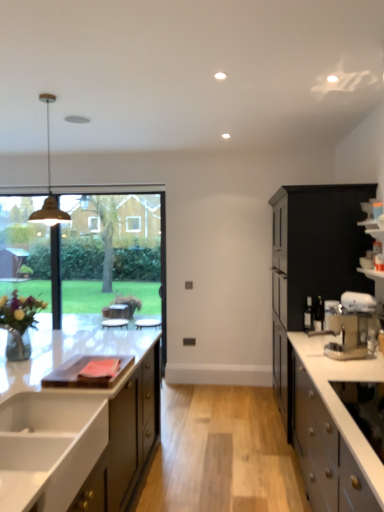
What do you see at coordinates (86, 254) in the screenshot? The width and height of the screenshot is (384, 512). I see `transparent glass window at center, acting as the second window screen starting from the left` at bounding box center [86, 254].

Measure the distance between point (146, 394) and camera.

Point (146, 394) and camera are 3.05 meters apart from each other.

Measure the distance between matte black cabinet at right, the 1th cabinetry in the right-to-left sequence, and camera.

They are 10.59 feet apart.

Describe the element at coordinates (320, 242) in the screenshot. The image size is (384, 512). I see `matte black cabinet at right, which is the third cabinetry from left to right` at that location.

Measure the distance between metallic silver coffee machine at right and camera.

metallic silver coffee machine at right is 2.58 meters from camera.

Locate an element on the screen. The width and height of the screenshot is (384, 512). transparent glass window at center, acting as the second window screen starting from the left is located at coordinates (86, 254).

From the image's perspective, is matte black cabinet at right, the 1th cabinetry in the right-to-left sequence, positioned above or below white glossy sink at lower left?

matte black cabinet at right, the 1th cabinetry in the right-to-left sequence, is situated higher than white glossy sink at lower left in the image.

Is the surface of matte black cabinet at right, the 1th cabinetry in the right-to-left sequence, in direct contact with white glossy sink at lower left?

No, matte black cabinet at right, the 1th cabinetry in the right-to-left sequence, is not in contact with white glossy sink at lower left.

What's the angular difference between matte black cabinet at right, which is the third cabinetry from left to right, and white glossy sink at lower left's facing directions?

The facing directions of matte black cabinet at right, which is the third cabinetry from left to right, and white glossy sink at lower left are 180 degrees apart.

In terms of height, does white matte cabinet at right, the 2th cabinetry in the left-to-right sequence, look taller or shorter compared to matte brass pendant light at upper left?

In the image, white matte cabinet at right, the 2th cabinetry in the left-to-right sequence, appears to be taller than matte brass pendant light at upper left.

Is white matte cabinet at right, which is counted as the second cabinetry, starting from the right, bigger or smaller than matte brass pendant light at upper left?

In the image, white matte cabinet at right, which is counted as the second cabinetry, starting from the right, appears to be larger than matte brass pendant light at upper left.

Is the surface of white matte cabinet at right, the 2th cabinetry in the left-to-right sequence, in direct contact with matte brass pendant light at upper left?

No, white matte cabinet at right, the 2th cabinetry in the left-to-right sequence, is not touching matte brass pendant light at upper left.

From a real-world perspective, is metallic silver coffee machine at right beneath matte brass pendant light at upper left?

Indeed, from a real-world perspective, metallic silver coffee machine at right is positioned beneath matte brass pendant light at upper left.

Locate an element on the screen. The height and width of the screenshot is (512, 384). coffee machine on the right side of matte brass pendant light at upper left is located at coordinates (351, 326).

Is metallic silver coffee machine at right inside or outside of matte brass pendant light at upper left?

metallic silver coffee machine at right exists outside the volume of matte brass pendant light at upper left.

Identify the location of the 2nd cabinetry located beneath the translucent glass window screen at left, the 2th window screen when ordered from right to left (from a real-world perspective). The image size is (384, 512). (340, 400).

Would you say translucent glass window screen at left, which ranks as the first window screen in left-to-right order, is inside or outside white matte cabinet at right, which is counted as the second cabinetry, starting from the right?

translucent glass window screen at left, which ranks as the first window screen in left-to-right order, exists outside the volume of white matte cabinet at right, which is counted as the second cabinetry, starting from the right.

From a real-world perspective, who is located lower, translucent glass window screen at left, which ranks as the first window screen in left-to-right order, or white matte cabinet at right, which is counted as the second cabinetry, starting from the right?

white matte cabinet at right, which is counted as the second cabinetry, starting from the right.

From the image's perspective, is translucent glass window screen at left, the 2th window screen when ordered from right to left, located above or below white matte cabinet at right, which is counted as the second cabinetry, starting from the right?

From the image's perspective, translucent glass window screen at left, the 2th window screen when ordered from right to left, appears above white matte cabinet at right, which is counted as the second cabinetry, starting from the right.

Which of these two, matte brass pendant light at upper left or matte black cabinet at right, which is the third cabinetry from left to right, is wider?

matte black cabinet at right, which is the third cabinetry from left to right.

From a real-world perspective, between matte brass pendant light at upper left and matte black cabinet at right, the 1th cabinetry in the right-to-left sequence, who is vertically higher?

In real-world perspective, matte brass pendant light at upper left is above.

Which object is further away from the camera taking this photo, matte brass pendant light at upper left or matte black cabinet at right, which is the third cabinetry from left to right?

Positioned behind is matte black cabinet at right, which is the third cabinetry from left to right.

Based on the photo, does matte brass pendant light at upper left have a lesser height compared to matte black cabinet at right, which is the third cabinetry from left to right?

→ Correct, matte brass pendant light at upper left is not as tall as matte black cabinet at right, which is the third cabinetry from left to right.

Which is behind, metallic silver coffee machine at right or matte white cabinetry at left, which is the 1th cabinetry in left-to-right order?

metallic silver coffee machine at right.

Which is more to the right, metallic silver coffee machine at right or matte white cabinetry at left, which is the 1th cabinetry in left-to-right order?

metallic silver coffee machine at right.

Can we say metallic silver coffee machine at right lies outside matte white cabinetry at left, which is the 1th cabinetry in left-to-right order?

Indeed, metallic silver coffee machine at right is completely outside matte white cabinetry at left, which is the 1th cabinetry in left-to-right order.

In the image, is translucent glass window screen at left, the 2th window screen when ordered from right to left, positioned in front of or behind matte black cabinet at right, the 1th cabinetry in the right-to-left sequence?

translucent glass window screen at left, the 2th window screen when ordered from right to left, is positioned farther from the viewer than matte black cabinet at right, the 1th cabinetry in the right-to-left sequence.

Does translucent glass window screen at left, the 2th window screen when ordered from right to left, turn towards matte black cabinet at right, the 1th cabinetry in the right-to-left sequence?

No, translucent glass window screen at left, the 2th window screen when ordered from right to left, is not oriented towards matte black cabinet at right, the 1th cabinetry in the right-to-left sequence.

From the translucent glass window screen at left, the 2th window screen when ordered from right to left, count 3rd cabinetry to the right and point to it. Please provide its 2D coordinates.

[(320, 242)]

Is point (45, 294) closer or farther from the camera than point (357, 238)?

Clearly, point (45, 294) is more distant from the camera than point (357, 238).

Find the location of a particular element. Image resolution: width=384 pixels, height=512 pixels. sink directly beneath the matte black cabinet at right, the 1th cabinetry in the right-to-left sequence (from a real-world perspective) is located at coordinates (48, 448).

The height and width of the screenshot is (512, 384). There is a matte brass pendant light at upper left. Find the location of `the 2nd cabinetry below it (from the image's perspective)`. the 2nd cabinetry below it (from the image's perspective) is located at coordinates (340, 400).

Looking at the image, which one is located further to matte brass pendant light at upper left, white glossy sink at lower left or matte white cabinetry at left, positioned as the third cabinetry in right-to-left order?

Among the two, white glossy sink at lower left is located further to matte brass pendant light at upper left.

Looking at the image, which one is located further to matte white cabinetry at left, positioned as the third cabinetry in right-to-left order, matte black cabinet at right, the 1th cabinetry in the right-to-left sequence, or metallic silver coffee machine at right?

Among the two, matte black cabinet at right, the 1th cabinetry in the right-to-left sequence, is located further to matte white cabinetry at left, positioned as the third cabinetry in right-to-left order.

Which object lies further to the anchor point matte black cabinet at right, the 1th cabinetry in the right-to-left sequence, transparent glass window at center, acting as the second window screen starting from the left, or white glossy sink at lower left?

Based on the image, transparent glass window at center, acting as the second window screen starting from the left, appears to be further to matte black cabinet at right, the 1th cabinetry in the right-to-left sequence.

Considering their positions, is white matte cabinet at right, which is counted as the second cabinetry, starting from the right, positioned closer to matte black cabinet at right, the 1th cabinetry in the right-to-left sequence, than translucent glass window screen at left, which ranks as the first window screen in left-to-right order?

white matte cabinet at right, which is counted as the second cabinetry, starting from the right.

When comparing their distances from matte black cabinet at right, which is the third cabinetry from left to right, does metallic silver coffee machine at right or matte white cabinetry at left, positioned as the third cabinetry in right-to-left order, seem further?

matte white cabinetry at left, positioned as the third cabinetry in right-to-left order.

When comparing their distances from matte white cabinetry at left, which is the 1th cabinetry in left-to-right order, does translucent glass window screen at left, the 2th window screen when ordered from right to left, or metallic silver coffee machine at right seem closer?

metallic silver coffee machine at right lies closer to matte white cabinetry at left, which is the 1th cabinetry in left-to-right order, than the other object.

From the image, which object appears to be farther from metallic silver coffee machine at right, transparent glass window at center, acting as the 1th window screen starting from the right, or matte brass pendant light at upper left?

matte brass pendant light at upper left is further to metallic silver coffee machine at right.

Which object lies further to the anchor point transparent glass window at center, acting as the 1th window screen starting from the right, metallic silver coffee machine at right or translucent glass window screen at left, which ranks as the first window screen in left-to-right order?

Based on the image, metallic silver coffee machine at right appears to be further to transparent glass window at center, acting as the 1th window screen starting from the right.

What are the coordinates of `sink situated between matte brass pendant light at upper left and metallic silver coffee machine at right from left to right` in the screenshot? It's located at (48, 448).

The height and width of the screenshot is (512, 384). Find the location of `light fixture positioned between white glossy sink at lower left and translucent glass window screen at left, the 2th window screen when ordered from right to left, from near to far`. light fixture positioned between white glossy sink at lower left and translucent glass window screen at left, the 2th window screen when ordered from right to left, from near to far is located at coordinates (49, 185).

Where is `light fixture situated between translucent glass window screen at left, which ranks as the first window screen in left-to-right order, and metallic silver coffee machine at right from left to right`? The height and width of the screenshot is (512, 384). light fixture situated between translucent glass window screen at left, which ranks as the first window screen in left-to-right order, and metallic silver coffee machine at right from left to right is located at coordinates (49, 185).

At what (x,y) coordinates should I click in order to perform the action: click on coffee machine between matte white cabinetry at left, positioned as the third cabinetry in right-to-left order, and white matte cabinet at right, the 2th cabinetry in the left-to-right sequence. Please return your answer as a coordinate pair (x, y). The height and width of the screenshot is (512, 384). Looking at the image, I should click on (351, 326).